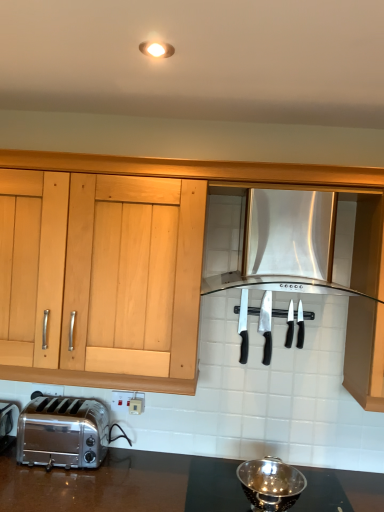
Question: Considering the relative sizes of polished stainless steel knife at center, the 2th silverware from the left, and black plastic knives at center, which is the third silverware in left-to-right order, in the image provided, is polished stainless steel knife at center, the 2th silverware from the left, shorter than black plastic knives at center, which is the third silverware in left-to-right order,?

Choices:
 (A) no
 (B) yes

Answer: (A)

Question: Is the position of polished stainless steel knife at center, the 2th silverware from the left, more distant than that of black plastic knives at center, which is the third silverware in left-to-right order?

Choices:
 (A) no
 (B) yes

Answer: (A)

Question: Could you tell me if polished stainless steel knife at center, which is counted as the 3th silverware, starting from the right, is turned towards black plastic knives at center, which is the third silverware in left-to-right order?

Choices:
 (A) no
 (B) yes

Answer: (A)

Question: Would you say polished stainless steel knife at center, which is counted as the 3th silverware, starting from the right, is outside black plastic knives at center, placed as the second silverware when sorted from right to left?

Choices:
 (A) no
 (B) yes

Answer: (B)

Question: Is polished stainless steel knife at center, the 2th silverware from the left, in front of black plastic knives at center, placed as the second silverware when sorted from right to left?

Choices:
 (A) yes
 (B) no

Answer: (A)

Question: From the image's perspective, relative to polished stainless steel knife at center, which is counted as the 3th silverware, starting from the right, is black plastic knives at center, placed as the second silverware when sorted from right to left, above or below?

Choices:
 (A) above
 (B) below

Answer: (A)

Question: From a real-world perspective, is black plastic knives at center, placed as the second silverware when sorted from right to left, physically located above or below polished stainless steel knife at center, which is counted as the 3th silverware, starting from the right?

Choices:
 (A) below
 (B) above

Answer: (B)

Question: In terms of height, does black plastic knives at center, placed as the second silverware when sorted from right to left, look taller or shorter compared to polished stainless steel knife at center, the 2th silverware from the left?

Choices:
 (A) short
 (B) tall

Answer: (A)

Question: Would you say black plastic knives at center, which is the third silverware in left-to-right order, is to the left or to the right of polished stainless steel knife at center, the 2th silverware from the left, in the picture?

Choices:
 (A) left
 (B) right

Answer: (B)

Question: From the image's perspective, relative to polished stainless steel knife at center, the 2th silverware from the left, is silver metallic knife at center, which ranks as the first silverware in left-to-right order, above or below?

Choices:
 (A) below
 (B) above

Answer: (B)

Question: Would you say silver metallic knife at center, the 4th silverware from the right, is to the left or to the right of polished stainless steel knife at center, the 2th silverware from the left, in the picture?

Choices:
 (A) left
 (B) right

Answer: (A)

Question: Does point (243, 298) appear closer or farther from the camera than point (269, 321)?

Choices:
 (A) closer
 (B) farther

Answer: (A)

Question: Choose the correct answer: Is silver metallic knife at center, which ranks as the first silverware in left-to-right order, inside polished stainless steel knife at center, the 2th silverware from the left, or outside it?

Choices:
 (A) inside
 (B) outside

Answer: (B)

Question: Looking at the image, does metallic reflective colander at lower center seem bigger or smaller compared to black plastic knives at center, which is the third silverware in left-to-right order?

Choices:
 (A) big
 (B) small

Answer: (A)

Question: In the image, is metallic reflective colander at lower center positioned in front of or behind black plastic knives at center, placed as the second silverware when sorted from right to left?

Choices:
 (A) behind
 (B) front

Answer: (B)